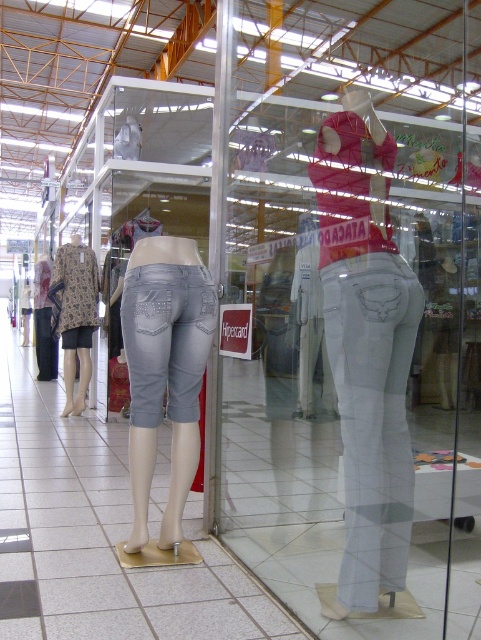
You are a customer in the clothing store and want to find the white denim pants at center. Based on the reflection in the glass display case, where should you look relative to the two mannequins on the left and right?

The white denim pants at center is located at the 2D coordinates point of [367,348] in the reflection, which is near the center of the glass display case between the two mannequins on the left and right.